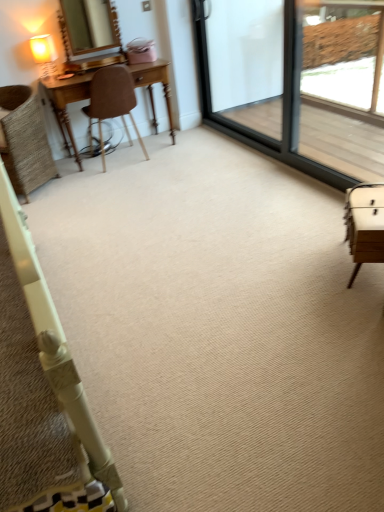
Question: From a real-world perspective, is matte gold mirror at upper left physically located above or below woven wicker chair at left, the second chair positioned from the right?

Choices:
 (A) below
 (B) above

Answer: (B)

Question: From the image's perspective, is matte gold mirror at upper left above or below woven wicker chair at left, the 1th chair viewed from the left?

Choices:
 (A) below
 (B) above

Answer: (B)

Question: Which object is the farthest from the matte gold mirror at upper left?

Choices:
 (A) transparent glass screen door at upper right, which appears as the second screen door when viewed from the right
 (B) brown leather chair at left, arranged as the 1th chair when viewed from the right
 (C) matte cream table lamp at upper left
 (D) woven wicker chair at left, the second chair positioned from the right
 (E) clear glass screen door at upper right, positioned as the second screen door in left-to-right order

Answer: (E)

Question: Estimate the real-world distances between objects in this image. Which object is closer to the matte gold mirror at upper left?

Choices:
 (A) matte cream table lamp at upper left
 (B) clear glass screen door at upper right, positioned as the second screen door in left-to-right order
 (C) transparent glass screen door at upper right, which appears as the second screen door when viewed from the right
 (D) brown leather chair at left, placed as the 2th chair when sorted from left to right
 (E) woven wicker chair at left, the 1th chair viewed from the left

Answer: (A)